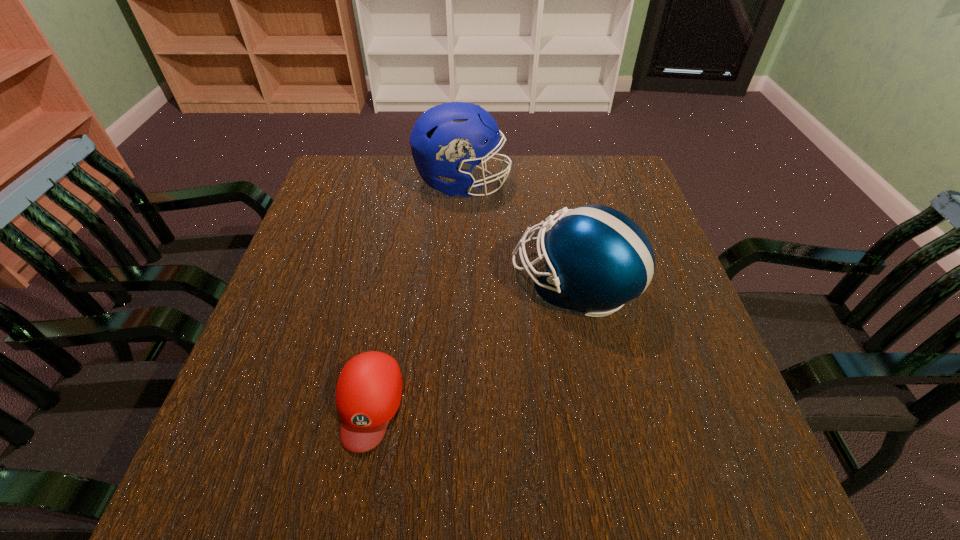
Locate an element on the screen. This screenshot has height=540, width=960. the farther football helmet is located at coordinates (445, 141).

You are a GUI agent. You are given a task and a screenshot of the screen. Output one action in this format:
    pyautogui.click(x=<x>, y=<y>)
    Task: Click on the second farthest object
    This screenshot has height=540, width=960.
    Given the screenshot: What is the action you would take?
    pyautogui.click(x=597, y=258)

Locate an element on the screen. The width and height of the screenshot is (960, 540). baseball cap is located at coordinates (369, 389).

At what (x,y) coordinates should I click in order to perform the action: click on the shortest object. Please return your answer as a coordinate pair (x, y). This screenshot has height=540, width=960. Looking at the image, I should click on (369, 389).

Where is `vacant point located 0.250m on the front-facing side of the farthest object`? vacant point located 0.250m on the front-facing side of the farthest object is located at coordinates (597, 184).

This screenshot has width=960, height=540. Find the location of `free spot located at the front of the second nearest object with the faceguard`. free spot located at the front of the second nearest object with the faceguard is located at coordinates (491, 285).

Find the location of `free spot located 0.120m at the front of the second nearest object with the faceguard`. free spot located 0.120m at the front of the second nearest object with the faceguard is located at coordinates (459, 285).

Locate an element on the screen. The width and height of the screenshot is (960, 540). vacant region located 0.250m at the front of the second nearest object with the faceguard is located at coordinates (401, 285).

You are a GUI agent. You are given a task and a screenshot of the screen. Output one action in this format:
    pyautogui.click(x=<x>, y=<y>)
    Task: Click on the vacant area located on the front-facing side of the shortest object
    The image size is (960, 540).
    Given the screenshot: What is the action you would take?
    pyautogui.click(x=352, y=487)

Where is `object located at the far edge`? The width and height of the screenshot is (960, 540). object located at the far edge is located at coordinates (445, 141).